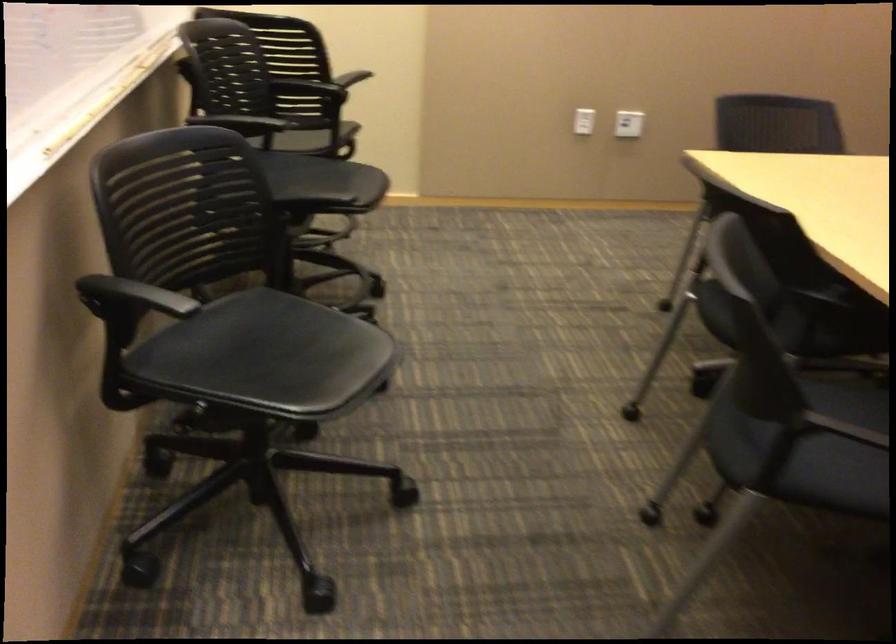
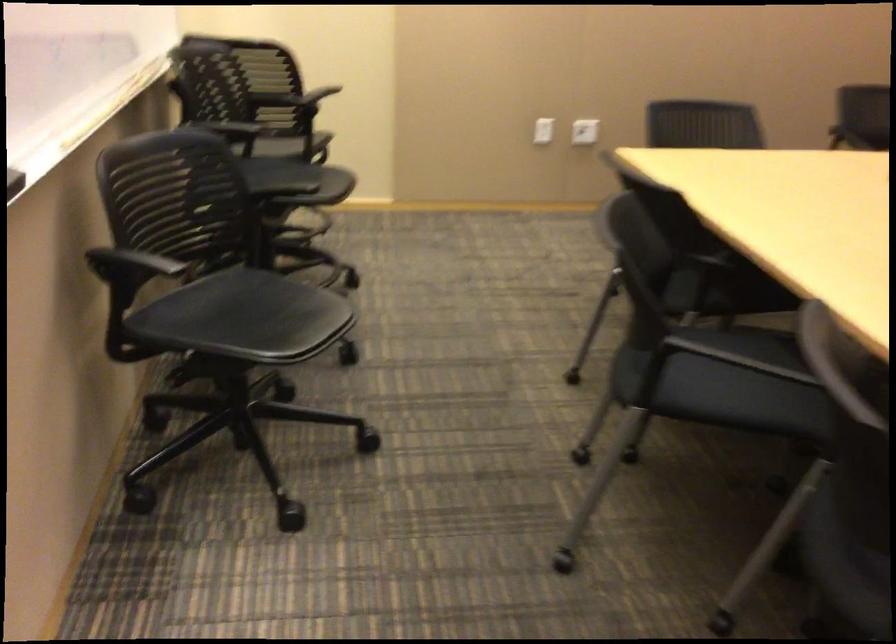
Question: The images are taken continuously from a first-person perspective. In which direction are you moving?

Choices:
 (A) Left
 (B) Right
 (C) Forward
 (D) Backward

Answer: (D)